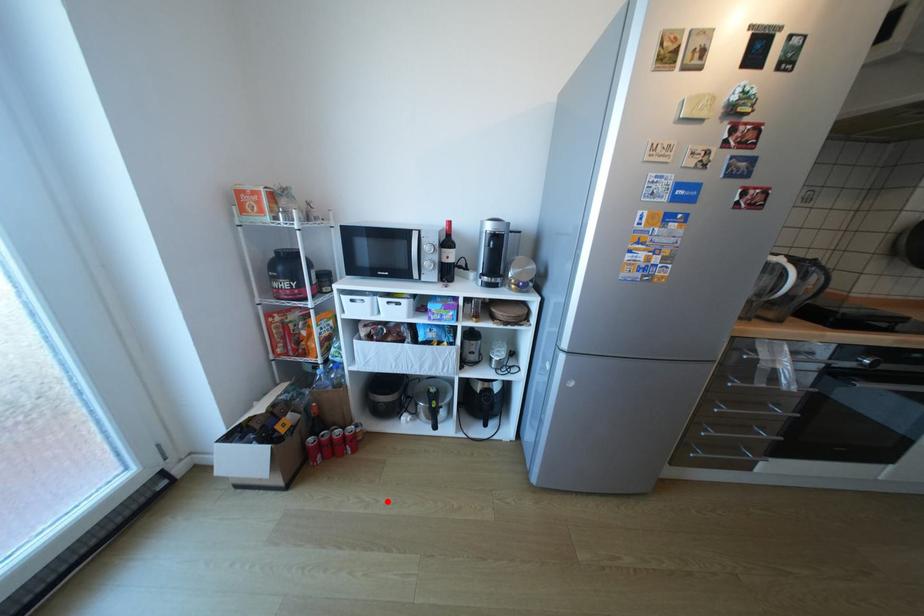
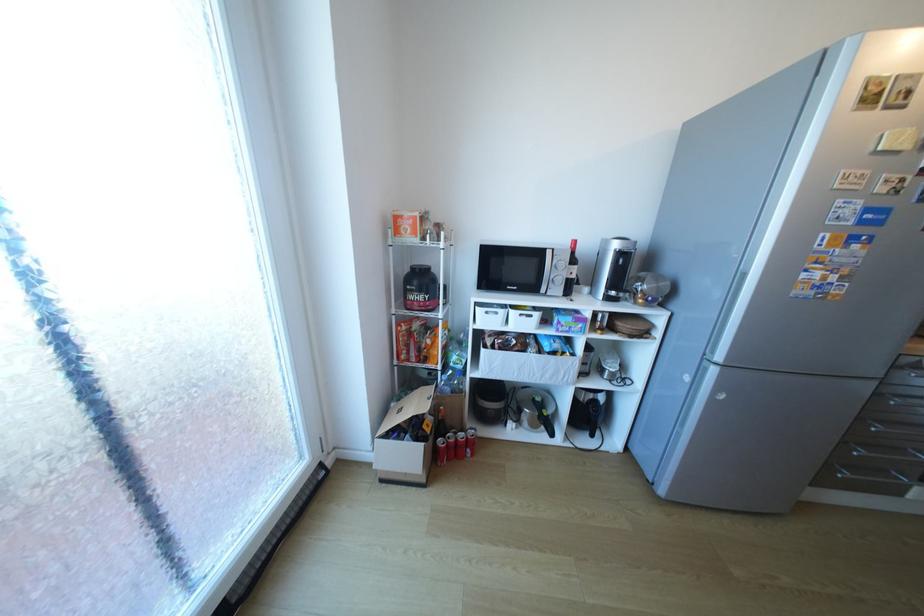
Find the pixel in the second image that matches the highlighted location in the first image.

(523, 504)